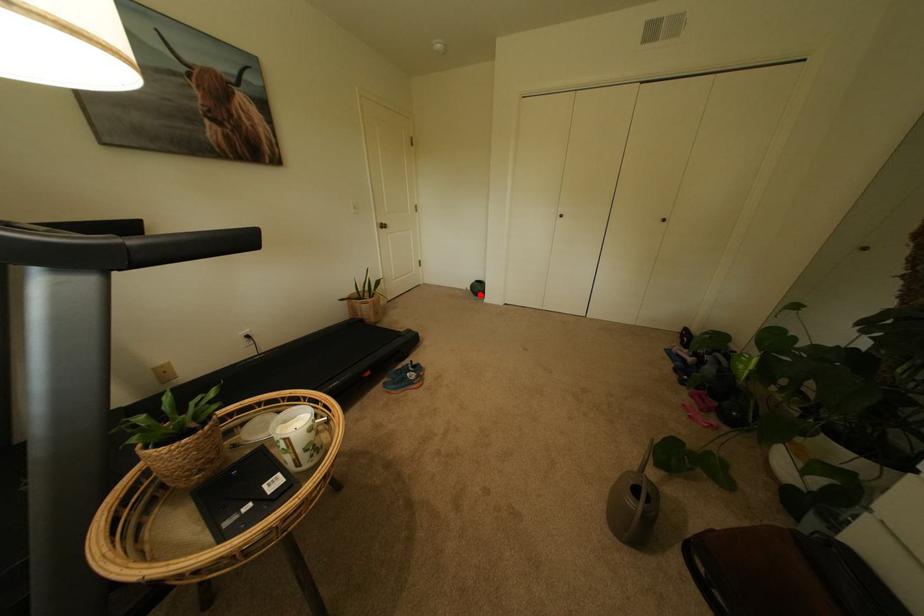
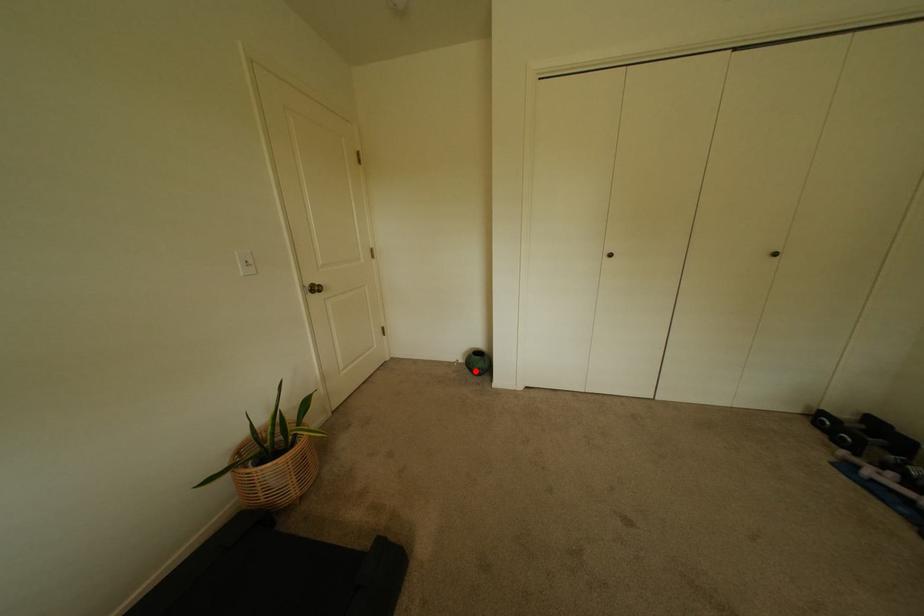
I am providing you with two images of the same scene from different viewpoints. A red point is marked on the first image and another point is marked on the second image. Is the marked point in image1 the same physical position as the marked point in image2?

Yes